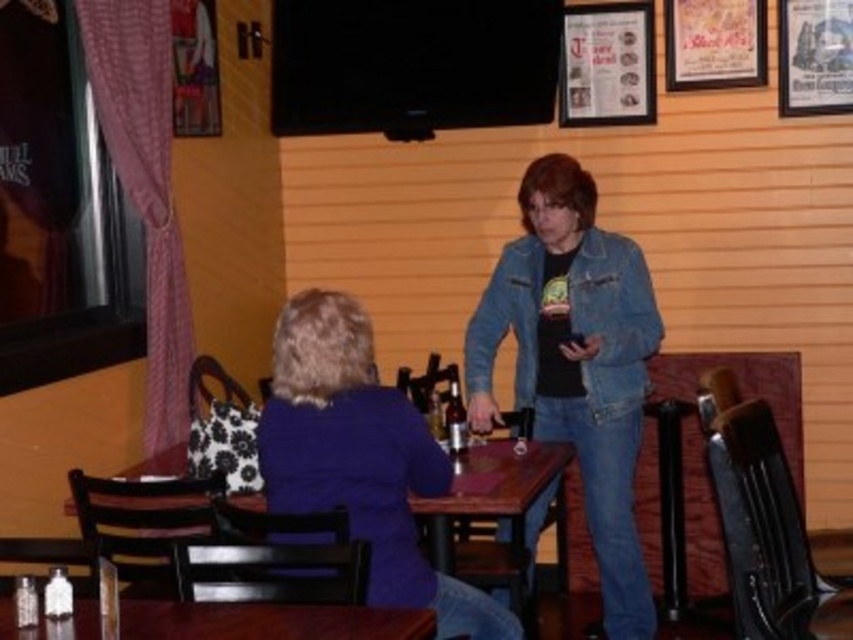
Question: Which point appears closest to the camera in this image?

Choices:
 (A) (184, 456)
 (B) (636, 579)
 (C) (300, 634)
 (D) (267, 500)

Answer: (C)

Question: Is denim jacket at center smaller than purple matte jacket at center?

Choices:
 (A) yes
 (B) no

Answer: (B)

Question: Does purple matte jacket at center have a smaller size compared to wooden table at lower left?

Choices:
 (A) yes
 (B) no

Answer: (B)

Question: Based on their relative distances, which object is nearer to the purple matte jacket at center?

Choices:
 (A) wooden table at center
 (B) wooden table at lower left

Answer: (A)

Question: Estimate the real-world distances between objects in this image. Which object is farther from the denim jacket at center?

Choices:
 (A) wooden table at lower left
 (B) wooden table at center
 (C) purple matte jacket at center

Answer: (A)

Question: Does denim jacket at center appear on the left side of purple matte jacket at center?

Choices:
 (A) yes
 (B) no

Answer: (B)